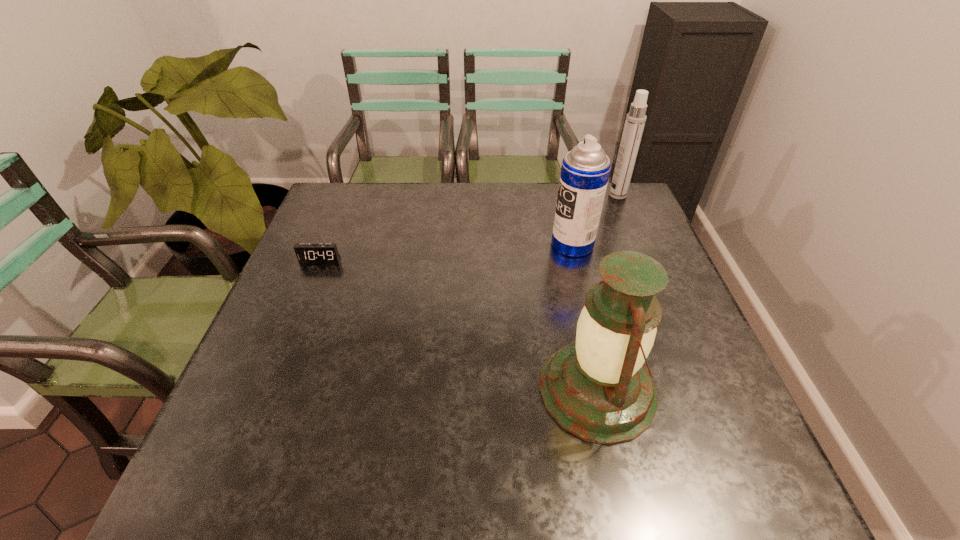
Identify the location of free space between the farther aerosol can and the leftmost object. (468, 227).

Where is `unoccupied position between the farthest object and the alarm clock`? unoccupied position between the farthest object and the alarm clock is located at coordinates (468, 227).

The width and height of the screenshot is (960, 540). What are the coordinates of `free space between the lantern and the leftmost object` in the screenshot? It's located at (459, 325).

Identify which object is the second closest to the leftmost object. Please provide its 2D coordinates. Your answer should be formatted as a tuple, i.e. [(x, y)], where the tuple contains the x and y coordinates of a point satisfying the conditions above.

[(585, 170)]

At what (x,y) coordinates should I click in order to perform the action: click on object that is the closest to the nearest object. Please return your answer as a coordinate pair (x, y). Looking at the image, I should click on (585, 170).

You are a GUI agent. You are given a task and a screenshot of the screen. Output one action in this format:
    pyautogui.click(x=<x>, y=<y>)
    Task: Click on the free space that satisfies the following two spatial constraints: 1. on the label side of the left aerosol can; 2. on the front-facing side of the alarm clock
    The width and height of the screenshot is (960, 540).
    Given the screenshot: What is the action you would take?
    pyautogui.click(x=576, y=260)

You are a GUI agent. You are given a task and a screenshot of the screen. Output one action in this format:
    pyautogui.click(x=<x>, y=<y>)
    Task: Click on the vacant space that satisfies the following two spatial constraints: 1. on the label side of the nearer aerosol can; 2. on the front-facing side of the leftmost object
    The image size is (960, 540).
    Given the screenshot: What is the action you would take?
    pyautogui.click(x=576, y=260)

You are a GUI agent. You are given a task and a screenshot of the screen. Output one action in this format:
    pyautogui.click(x=<x>, y=<y>)
    Task: Click on the free space that satisfies the following two spatial constraints: 1. on the label side of the left aerosol can; 2. on the front-facing side of the alarm clock
    This screenshot has width=960, height=540.
    Given the screenshot: What is the action you would take?
    pyautogui.click(x=576, y=260)

The height and width of the screenshot is (540, 960). Find the location of `vacant space that satisfies the following two spatial constraints: 1. on the label side of the nearer aerosol can; 2. on the front-facing side of the leftmost object`. vacant space that satisfies the following two spatial constraints: 1. on the label side of the nearer aerosol can; 2. on the front-facing side of the leftmost object is located at coordinates (576, 260).